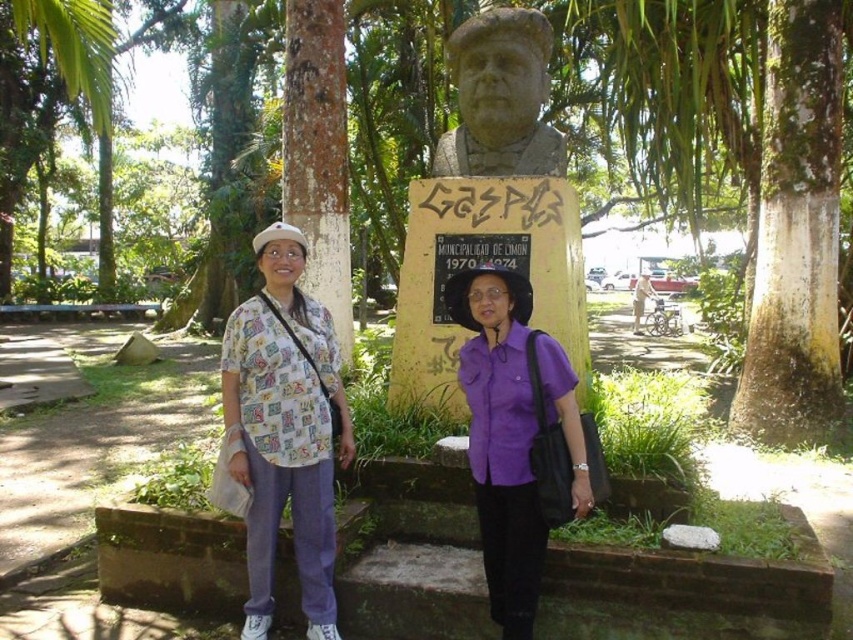
Does printed cotton shirt at left have a smaller size compared to purple matte shirt at center?

No.

Is printed cotton shirt at left positioned at the back of purple matte shirt at center?

Yes, it is behind purple matte shirt at center.

The image size is (853, 640). What do you see at coordinates (285, 429) in the screenshot?
I see `printed cotton shirt at left` at bounding box center [285, 429].

The width and height of the screenshot is (853, 640). Find the location of `printed cotton shirt at left`. printed cotton shirt at left is located at coordinates (285, 429).

Is green bark tree at center taller than stone statue at center?

Correct, green bark tree at center is much taller as stone statue at center.

Describe the element at coordinates (734, 163) in the screenshot. I see `green bark tree at center` at that location.

The image size is (853, 640). I want to click on green bark tree at center, so click(734, 163).

Does green bark tree at center have a lesser width compared to printed cotton shirt at left?

In fact, green bark tree at center might be wider than printed cotton shirt at left.

What do you see at coordinates (734, 163) in the screenshot? I see `green bark tree at center` at bounding box center [734, 163].

Measure the distance between green bark tree at center and camera.

green bark tree at center is 14.62 feet away from camera.

Locate an element on the screen. Image resolution: width=853 pixels, height=640 pixels. green bark tree at center is located at coordinates (734, 163).